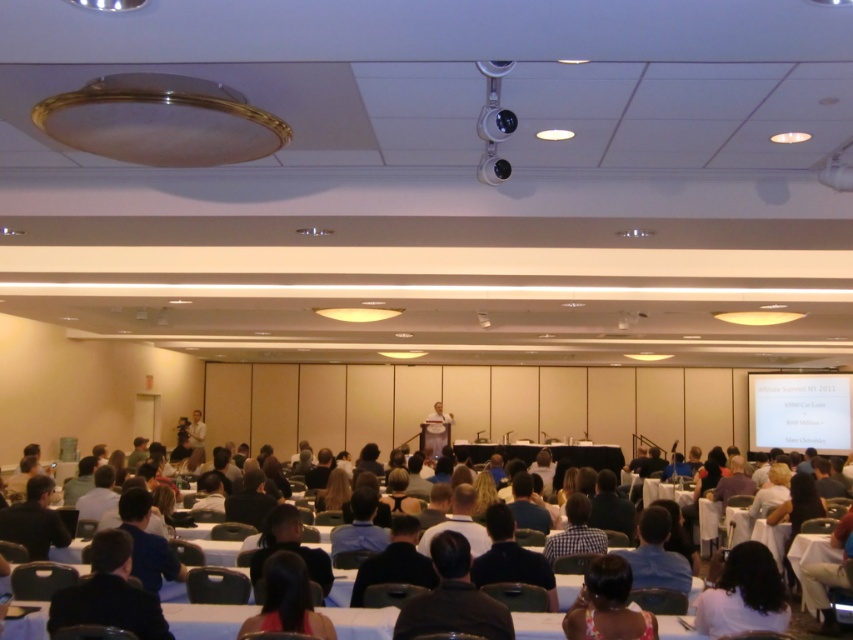
Does dark brown chairs at center appear on the left side of white matte projection screen at center?

Yes, dark brown chairs at center is to the left of white matte projection screen at center.

Does point (242, 608) come behind point (804, 429)?

No, it is not.

Does point (38, 628) come farther from viewer compared to point (822, 403)?

That is False.

Where is `dark brown chairs at center`? The image size is (853, 640). dark brown chairs at center is located at coordinates (206, 620).